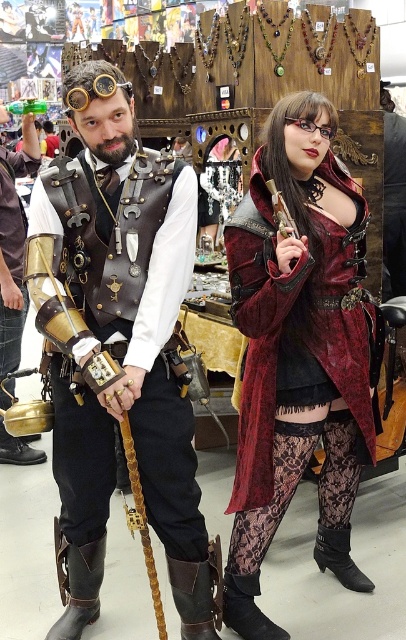
You are a photographer at the event and want to capture both the velvet maroon coat at center and the matte gold armor at left in a single shot. Based on their sizes, which object should you position closer to the camera to ensure both are visible clearly?

The velvet maroon coat at center is much taller than the matte gold armor at left, so positioning the matte gold armor at left closer to the camera will help balance their sizes in the photo, making both appear clearer.

From the picture: You are a costume designer examining the two center pieces of the steampunk costume. Which item is visible on top, the leather vest at center or the velvet maroon coat at center?

The leather vest at center is positioned over the velvet maroon coat at center, so the leather vest at center is visible on top.